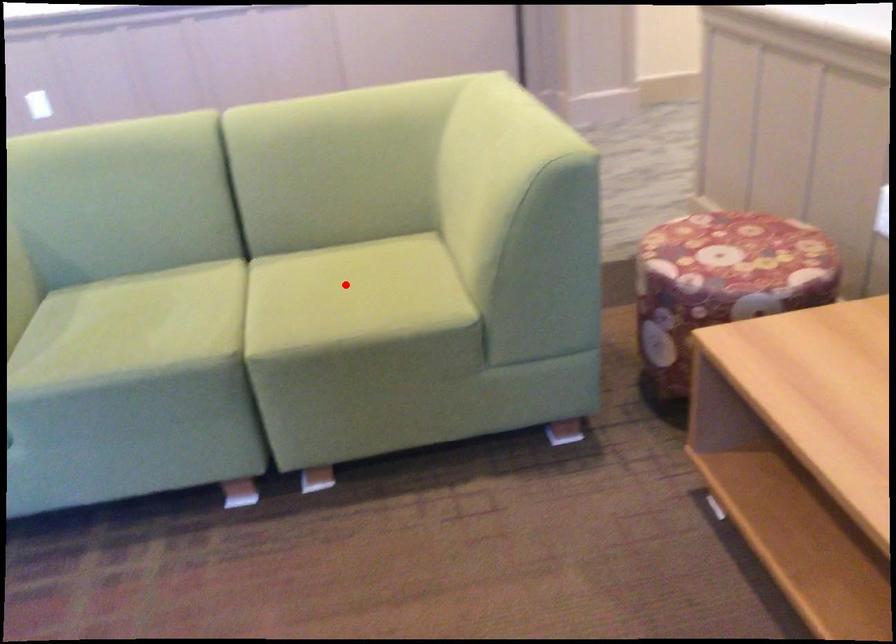
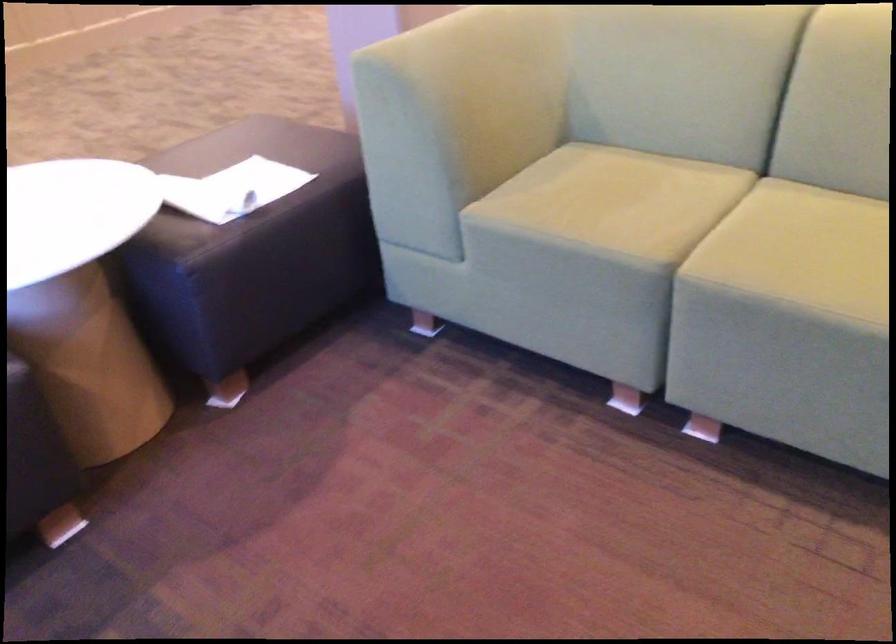
Question: I am providing you with two images of the same scene from different viewpoints. Given a red point in image1, look at the same physical point in image2. Is it:

Choices:
 (A) Closer to the viewpoint
 (B) Farther from the viewpoint

Answer: (A)